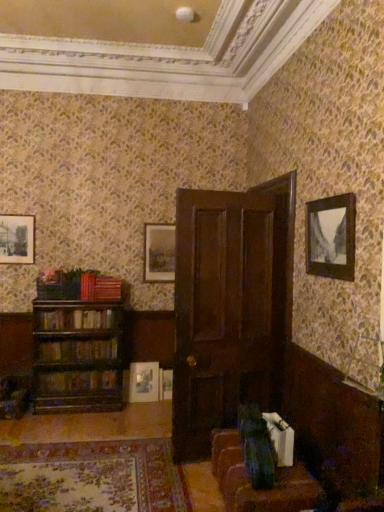
Question: From a real-world perspective, is velvet brown couch at lower right on wooden book at left, which is the fourth book from top to bottom?

Choices:
 (A) no
 (B) yes

Answer: (A)

Question: From a real-world perspective, is velvet brown couch at lower right positioned under wooden book at left, arranged as the 1th book when ordered from the bottom, based on gravity?

Choices:
 (A) no
 (B) yes

Answer: (B)

Question: Can you confirm if velvet brown couch at lower right is thinner than wooden book at left, which is the fourth book from top to bottom?

Choices:
 (A) no
 (B) yes

Answer: (A)

Question: Is wooden book at left, arranged as the 1th book when ordered from the bottom, inside velvet brown couch at lower right?

Choices:
 (A) yes
 (B) no

Answer: (B)

Question: Can you confirm if velvet brown couch at lower right is taller than wooden book at left, which is the fourth book from top to bottom?

Choices:
 (A) yes
 (B) no

Answer: (A)

Question: Choose the correct answer: Is red matte book at left, marked as the fourth book in a bottom-to-top arrangement, inside matte wooden picture frame at center, which is the first picture frame in back-to-front order, or outside it?

Choices:
 (A) inside
 (B) outside

Answer: (B)

Question: From the image's perspective, is red matte book at left, marked as the fourth book in a bottom-to-top arrangement, positioned above or below matte wooden picture frame at center, which is the 3th picture frame in top-to-bottom order?

Choices:
 (A) below
 (B) above

Answer: (A)

Question: Considering the positions of red matte book at left, marked as the fourth book in a bottom-to-top arrangement, and matte wooden picture frame at center, the 3th picture frame in the left-to-right sequence, in the image, is red matte book at left, marked as the fourth book in a bottom-to-top arrangement, bigger or smaller than matte wooden picture frame at center, the 3th picture frame in the left-to-right sequence,?

Choices:
 (A) small
 (B) big

Answer: (A)

Question: Considering the positions of red matte book at left, the 1th book positioned from the top, and matte wooden picture frame at center, which is the first picture frame in back-to-front order, in the image, is red matte book at left, the 1th book positioned from the top, wider or thinner than matte wooden picture frame at center, which is the first picture frame in back-to-front order,?

Choices:
 (A) wide
 (B) thin

Answer: (A)

Question: From a real-world perspective, is velvet brown couch at lower right above or below red matte book at left, marked as the fourth book in a bottom-to-top arrangement?

Choices:
 (A) above
 (B) below

Answer: (B)

Question: Does point (230, 496) appear closer or farther from the camera than point (82, 285)?

Choices:
 (A) farther
 (B) closer

Answer: (B)

Question: From the image's perspective, is velvet brown couch at lower right located above or below red matte book at left, marked as the fourth book in a bottom-to-top arrangement?

Choices:
 (A) above
 (B) below

Answer: (B)

Question: Is velvet brown couch at lower right bigger or smaller than red matte book at left, marked as the fourth book in a bottom-to-top arrangement?

Choices:
 (A) small
 (B) big

Answer: (B)

Question: Would you say wooden book at left, arranged as the 1th book when ordered from the bottom, is inside or outside dark wood door at center?

Choices:
 (A) inside
 (B) outside

Answer: (B)

Question: Would you say wooden book at left, arranged as the 1th book when ordered from the bottom, is to the left or to the right of dark wood door at center in the picture?

Choices:
 (A) right
 (B) left

Answer: (B)